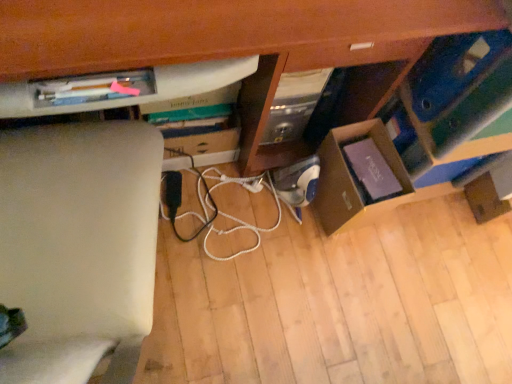
Question: Is wooden computer desk at center in contact with blue cardboard box at lower right?

Choices:
 (A) yes
 (B) no

Answer: (B)

Question: Considering the relative sizes of wooden computer desk at center and blue cardboard box at lower right in the image provided, is wooden computer desk at center shorter than blue cardboard box at lower right?

Choices:
 (A) yes
 (B) no

Answer: (B)

Question: Considering the relative sizes of wooden computer desk at center and blue cardboard box at lower right in the image provided, is wooden computer desk at center smaller than blue cardboard box at lower right?

Choices:
 (A) yes
 (B) no

Answer: (B)

Question: From the image's perspective, is wooden computer desk at center below blue cardboard box at lower right?

Choices:
 (A) yes
 (B) no

Answer: (B)

Question: Could you tell me if wooden computer desk at center is facing blue cardboard box at lower right?

Choices:
 (A) yes
 (B) no

Answer: (B)

Question: Considering their positions, is white cord at center located in front of or behind blue cardboard box at lower right?

Choices:
 (A) front
 (B) behind

Answer: (B)

Question: Is white cord at center wider or thinner than blue cardboard box at lower right?

Choices:
 (A) thin
 (B) wide

Answer: (A)

Question: From the image's perspective, relative to blue cardboard box at lower right, is white cord at center above or below?

Choices:
 (A) below
 (B) above

Answer: (A)

Question: Would you say white cord at center is to the left or to the right of blue cardboard box at lower right in the picture?

Choices:
 (A) right
 (B) left

Answer: (B)

Question: From their relative heights in the image, would you say blue cardboard box at lower right is taller or shorter than wooden computer desk at center?

Choices:
 (A) short
 (B) tall

Answer: (A)

Question: From the image's perspective, is blue cardboard box at lower right located above or below wooden computer desk at center?

Choices:
 (A) below
 (B) above

Answer: (A)

Question: From a real-world perspective, is blue cardboard box at lower right above or below wooden computer desk at center?

Choices:
 (A) below
 (B) above

Answer: (A)

Question: Is blue cardboard box at lower right to the left or to the right of wooden computer desk at center in the image?

Choices:
 (A) right
 (B) left

Answer: (A)

Question: Looking at the image, does wooden computer desk at center seem bigger or smaller compared to cardboard box at lower right?

Choices:
 (A) small
 (B) big

Answer: (B)

Question: Choose the correct answer: Is wooden computer desk at center inside cardboard box at lower right or outside it?

Choices:
 (A) inside
 (B) outside

Answer: (B)